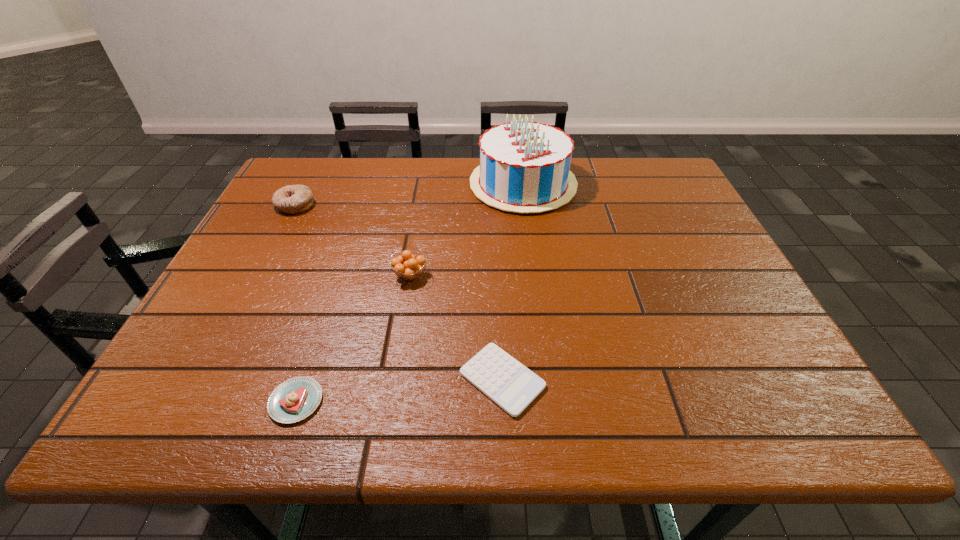
Locate an element on the screen. Image resolution: width=960 pixels, height=540 pixels. the tallest object is located at coordinates (524, 167).

Where is `the fourth shortest object`? The width and height of the screenshot is (960, 540). the fourth shortest object is located at coordinates (408, 267).

This screenshot has height=540, width=960. Identify the location of orange fruit. (408, 267).

Identify the location of doughnut. (293, 199).

The image size is (960, 540). Find the location of `the third tallest object`. the third tallest object is located at coordinates [x=293, y=199].

Locate an element on the screen. The image size is (960, 540). pastry is located at coordinates click(295, 399).

In order to click on the second object from left to right in this screenshot , I will do `click(295, 399)`.

The image size is (960, 540). In order to click on calculator in this screenshot , I will do `click(512, 386)`.

The width and height of the screenshot is (960, 540). What are the coordinates of `free space located on the left of the birthday cake` in the screenshot? It's located at (363, 184).

In order to click on free point located on the right of the fourth shortest object in this screenshot , I will do `click(481, 275)`.